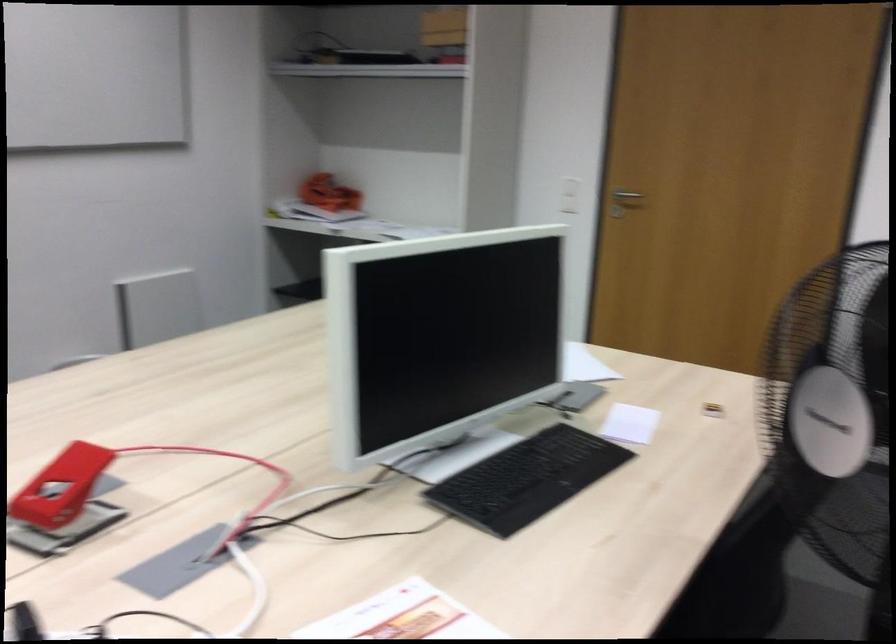
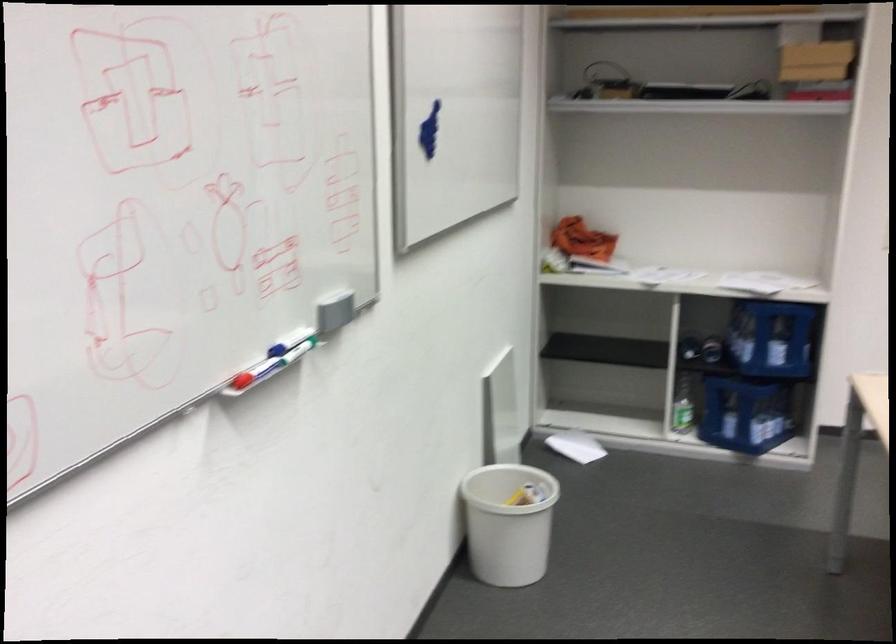
Question: I am providing you with two images of the same scene from different viewpoints. Please identify which objects are invisible in image2.

Choices:
 (A) blue whiteboard marker
 (B) grey whiteboard eraser
 (C) white paper sheet
 (D) none of these

Answer: (D)